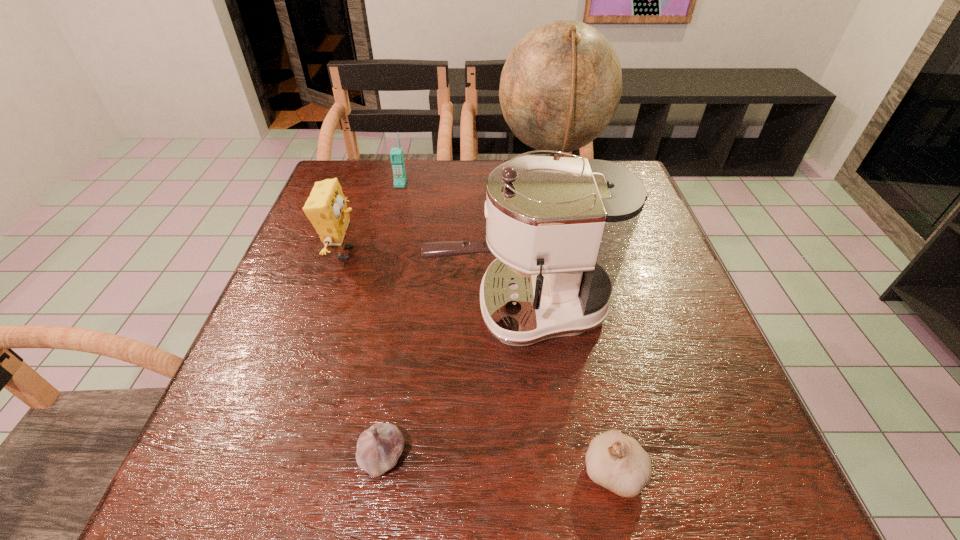
The height and width of the screenshot is (540, 960). I want to click on globe, so click(560, 87).

The image size is (960, 540). What are the coordinates of `the fifth shortest object` in the screenshot? It's located at (560, 227).

The width and height of the screenshot is (960, 540). I want to click on sponge, so click(326, 208).

Locate an element on the screen. the second object from left to right is located at coordinates (396, 155).

This screenshot has width=960, height=540. What are the coordinates of `the fourth object from right to left` in the screenshot? It's located at (378, 448).

This screenshot has height=540, width=960. Find the location of `the right garlic`. the right garlic is located at coordinates (615, 461).

What are the coordinates of `vacant area situated 0.300m on the front-facing side of the globe` in the screenshot? It's located at click(x=391, y=189).

Image resolution: width=960 pixels, height=540 pixels. Find the location of `vacant space located 0.240m on the front-facing side of the globe`. vacant space located 0.240m on the front-facing side of the globe is located at coordinates (412, 189).

Image resolution: width=960 pixels, height=540 pixels. In order to click on vacant position located on the front-facing side of the globe in this screenshot , I will do `click(391, 189)`.

In order to click on free space located 0.240m on the front-facing side of the coffee maker in this screenshot , I will do coord(314,309).